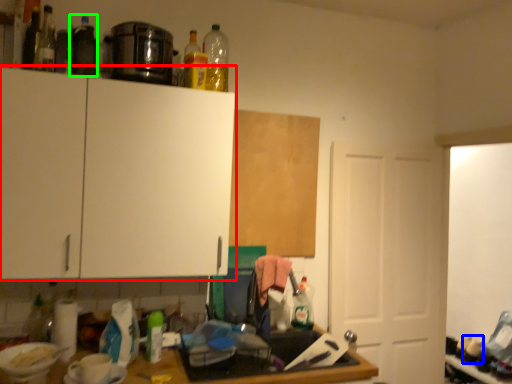
Question: Which object is positioned closest to cabinetry (highlighted by a red box)? Select from bottle (highlighted by a blue box) and bottle (highlighted by a green box).

Choices:
 (A) bottle
 (B) bottle

Answer: (B)